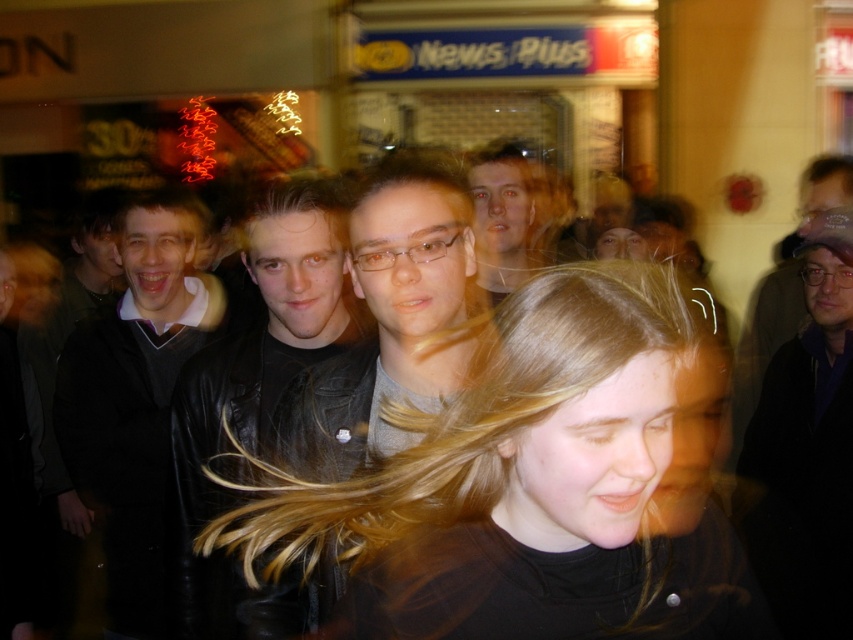
You are a fashion photographer trying to capture a closeup of the dark blue leather jacket at right and the matte black jacket at center. Since you want both jackets to appear the same size in the photo, which jacket should you move closer to the camera and which should you move farther away?

The dark blue leather jacket at right is larger in size than the matte black jacket at center. To make them appear the same size in the photo, move the matte black jacket at center closer to the camera and move the dark blue leather jacket at right farther away.

You are a photographer trying to capture a clear shot of both the leather jacket at center and the matte black jacket at center. Since they are both at the center, which one should you focus on first to ensure both are in frame?

The leather jacket at center is to the left of matte black jacket at center, so focusing on the leather jacket at center first will ensure both are in frame as you pan right.